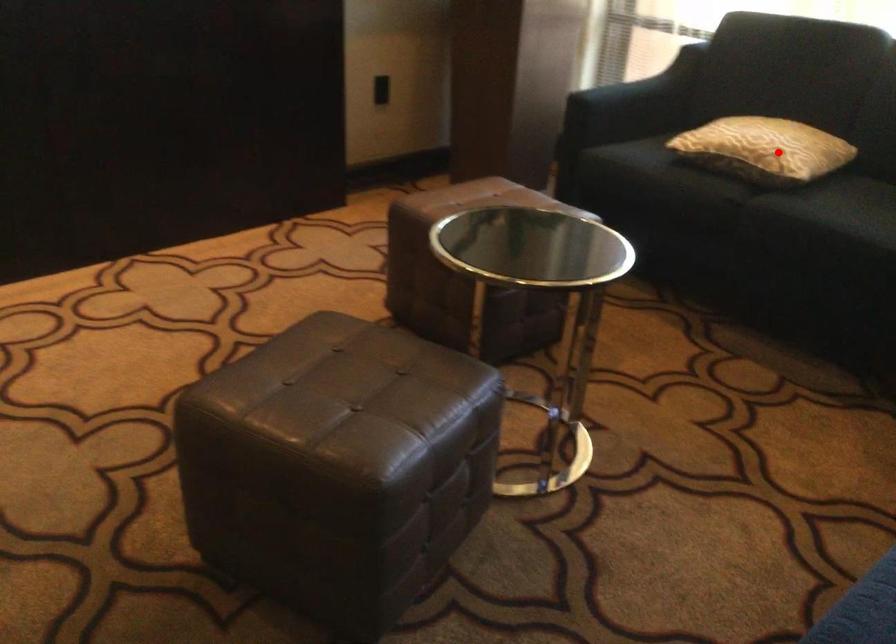
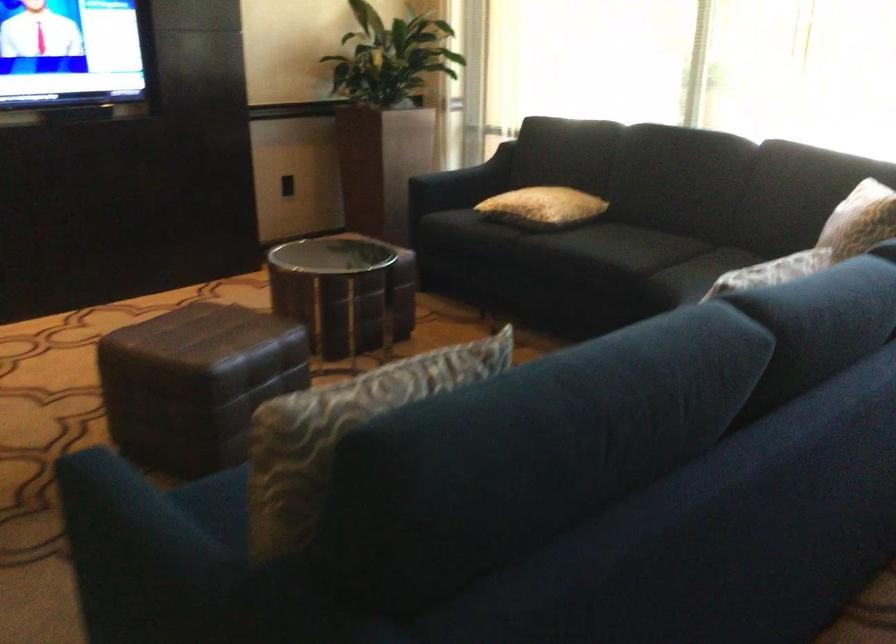
The point at the highlighted location is marked in the first image. Where is the corresponding point in the second image?

(543, 207)